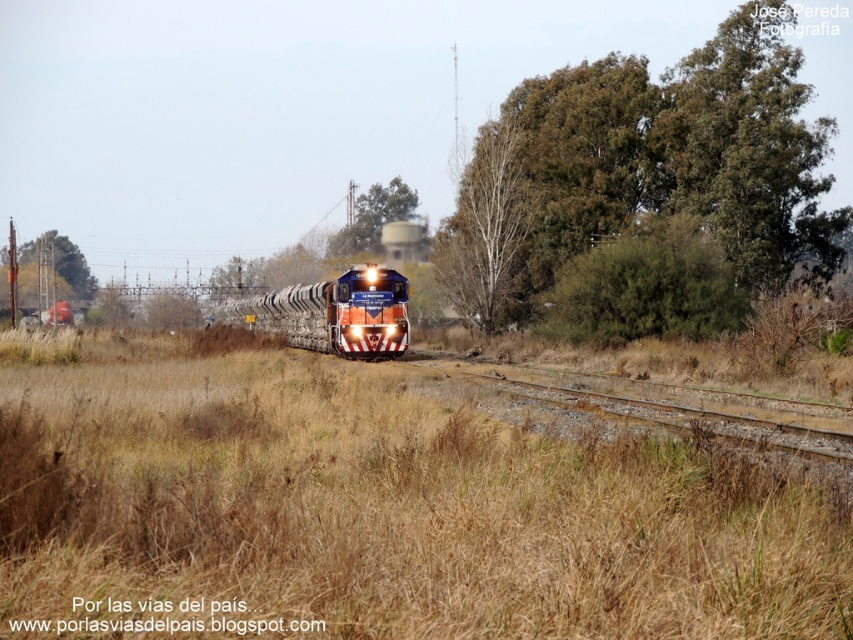
Question: Which object appears farthest from the camera in this image?

Choices:
 (A) green leafy tree at center
 (B) bare wood tree at center
 (C) green leafy tree at upper right

Answer: (A)

Question: Can you confirm if green leafy tree at upper right is positioned below bare wood tree at center?

Choices:
 (A) yes
 (B) no

Answer: (A)

Question: Does brown dry grass at center have a greater width compared to green leafy tree at upper right?

Choices:
 (A) yes
 (B) no

Answer: (B)

Question: Does brown dry grass at center come in front of blue glossy locomotive at center?

Choices:
 (A) yes
 (B) no

Answer: (A)

Question: Which object is closer to the camera taking this photo?

Choices:
 (A) green leafy tree at upper right
 (B) green leafy tree at upper center
 (C) bare wood tree at center

Answer: (A)

Question: Which point is farther from the camera taking this photo?

Choices:
 (A) 817,429
 (B) 463,205
 (C) 315,326
 (D) 416,205

Answer: (D)